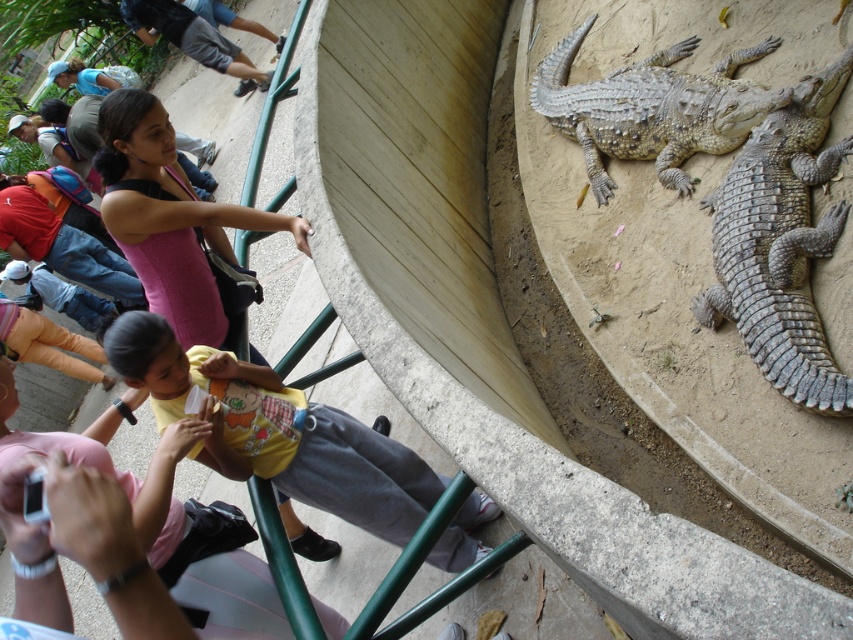
You are standing at the center of the zoo enclosure and want to take a photo of the gray textured crocodile at right. To ensure the crocodile is centered in your photo, where should you position your camera relative to the enclosure? Please provide coordinates based on the image grid where the center is at point 0,0 and the top right corner is at 1,1.

The gray textured crocodile at right is located at point (780, 244). To center it in your photo, position your camera at those coordinates on the image grid.

Looking at this image, you are a zookeeper responsible for maintaining the safety of the enclosure. The minimum required distance between any two animals in this enclosure is 1.0 meters to ensure they donot interfere with each other. Based on the image provided, do the gray textured crocodile at right and the gray scaly crocodile at upper right meet this safety requirement?

The distance between the gray textured crocodile at right and the gray scaly crocodile at upper right is 1.04 meters, which meets the minimum required distance of 1.0 meters. Therefore, they are within the safety guidelines.